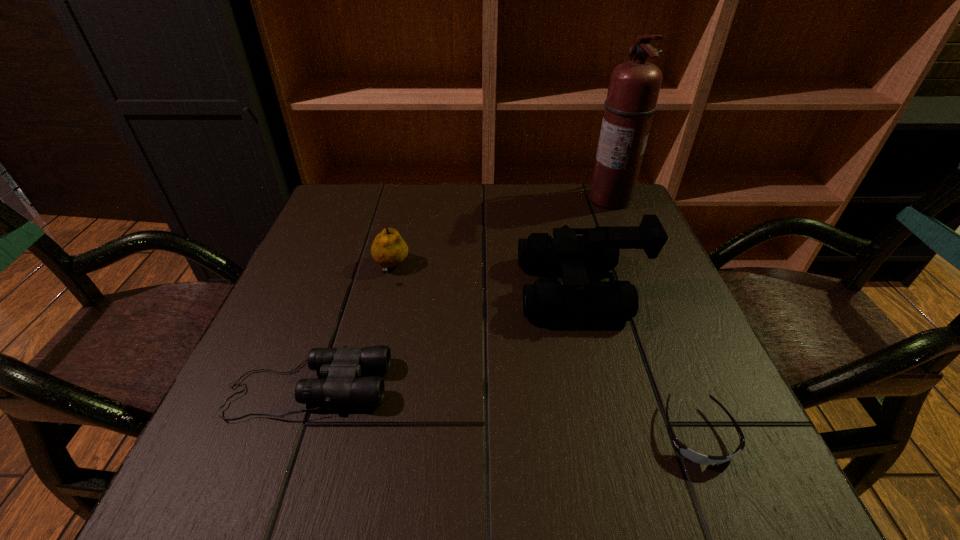
Identify the location of vacant region located 0.160m on the front-facing side of the farthest object. The height and width of the screenshot is (540, 960). (529, 199).

The image size is (960, 540). Identify the location of vacant region located on the front lenses of the farther binoculars. (337, 289).

Locate an element on the screen. This screenshot has width=960, height=540. blank space located on the front lenses of the farther binoculars is located at coordinates (439, 289).

Locate an element on the screen. This screenshot has width=960, height=540. vacant space positioned 0.070m on the front lenses of the farther binoculars is located at coordinates (487, 289).

Where is `blank space located 0.160m on the front of the third tallest object`? blank space located 0.160m on the front of the third tallest object is located at coordinates (372, 345).

Identify the location of vacant space located 0.260m at the eyepiece of the nearer binoculars. This screenshot has height=540, width=960. (543, 388).

This screenshot has width=960, height=540. Identify the location of object that is at the far edge. (634, 86).

What are the coordinates of `object that is at the near edge` in the screenshot? It's located at (682, 449).

Find the location of `object present at the left edge`. object present at the left edge is located at coordinates (342, 367).

Where is `fire extinguisher located at the right edge`? fire extinguisher located at the right edge is located at coordinates (634, 86).